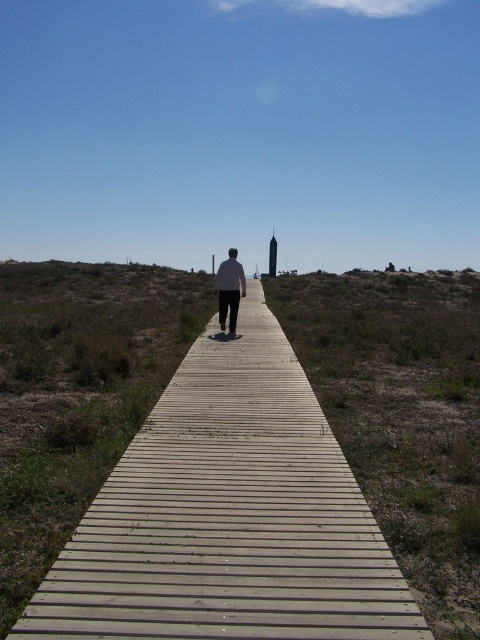
Which of these two, wooden planks at center or white matte shirt at center, stands taller?

Standing taller between the two is white matte shirt at center.

Does point (199, 522) lie behind point (240, 262)?

No, (199, 522) is in front of (240, 262).

Where is `wooden planks at center`? The width and height of the screenshot is (480, 640). wooden planks at center is located at coordinates (228, 516).